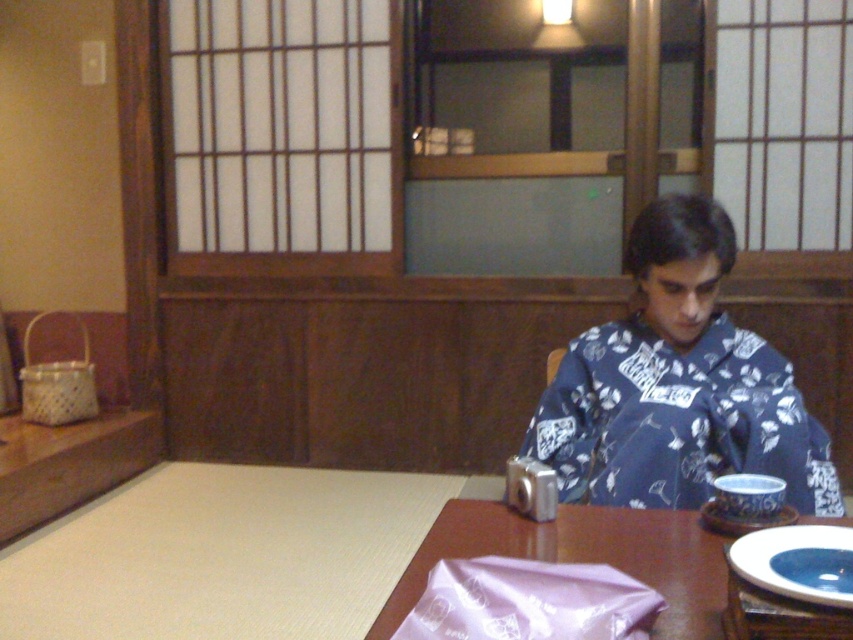
Can you confirm if brown wooden table at center is smaller than blue floral kimono at center?

Actually, brown wooden table at center might be larger than blue floral kimono at center.

Which is behind, point (331, 608) or point (535, 426)?

The point (331, 608) is more distant.

Between point (520, 547) and point (735, 365), which one is positioned in front?

Positioned in front is point (520, 547).

This screenshot has height=640, width=853. I want to click on brown wooden table at center, so [x=227, y=554].

Can you confirm if blue floral kimono at center is bigger than blue glossy plate at lower right?

Correct, blue floral kimono at center is larger in size than blue glossy plate at lower right.

Is blue floral kimono at center positioned behind blue glossy plate at lower right?

That is True.

What do you see at coordinates (677, 385) in the screenshot? I see `blue floral kimono at center` at bounding box center [677, 385].

Image resolution: width=853 pixels, height=640 pixels. Find the location of `blue floral kimono at center`. blue floral kimono at center is located at coordinates click(677, 385).

Is the position of brown wooden table at center less distant than that of blue glossy plate at lower right?

No, brown wooden table at center is behind blue glossy plate at lower right.

Is brown wooden table at center above blue glossy plate at lower right?

No, brown wooden table at center is not above blue glossy plate at lower right.

Describe the element at coordinates (227, 554) in the screenshot. The height and width of the screenshot is (640, 853). I see `brown wooden table at center` at that location.

Identify the location of brown wooden table at center. (227, 554).